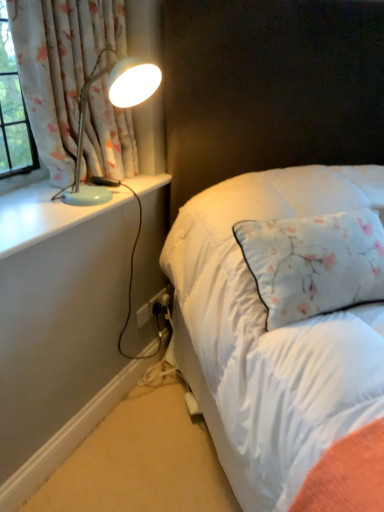
Question: From the image's perspective, relative to matte blue lamp at left, is white matte power strip at lower center above or below?

Choices:
 (A) above
 (B) below

Answer: (B)

Question: Is white matte power strip at lower center to the left or to the right of matte blue lamp at left in the image?

Choices:
 (A) right
 (B) left

Answer: (B)

Question: Which object is the farthest from the floral fabric curtain at upper left?

Choices:
 (A) white quilted bed at center
 (B) matte blue lamp at left
 (C) white glossy window sill at left
 (D) white matte power strip at lower center
 (E) black plastic electric outlet at lower center

Answer: (E)

Question: Which object is the closest to the floral fabric curtain at upper left?

Choices:
 (A) black plastic electric outlet at lower center
 (B) white quilted bed at center
 (C) white matte power strip at lower center
 (D) white glossy window sill at left
 (E) matte blue lamp at left

Answer: (E)